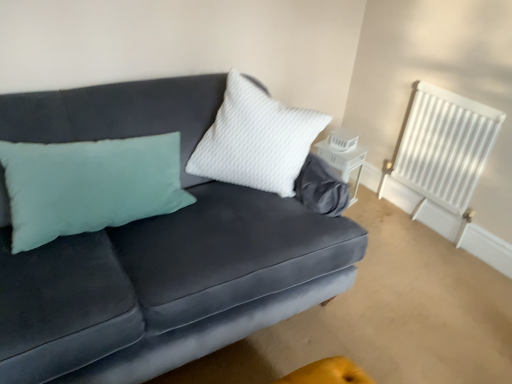
Question: From a real-world perspective, relative to velvet dark blue couch at center, is white matte lantern at center vertically above or below?

Choices:
 (A) below
 (B) above

Answer: (A)

Question: In the image, is white matte lantern at center on the left side or the right side of velvet dark blue couch at center?

Choices:
 (A) left
 (B) right

Answer: (B)

Question: Which object is the farthest from the white matte lantern at center?

Choices:
 (A) white painted metal radiator at upper right
 (B) velvet dark blue couch at center

Answer: (B)

Question: Which is farther from the white painted metal radiator at upper right?

Choices:
 (A) velvet dark blue couch at center
 (B) white matte lantern at center

Answer: (A)